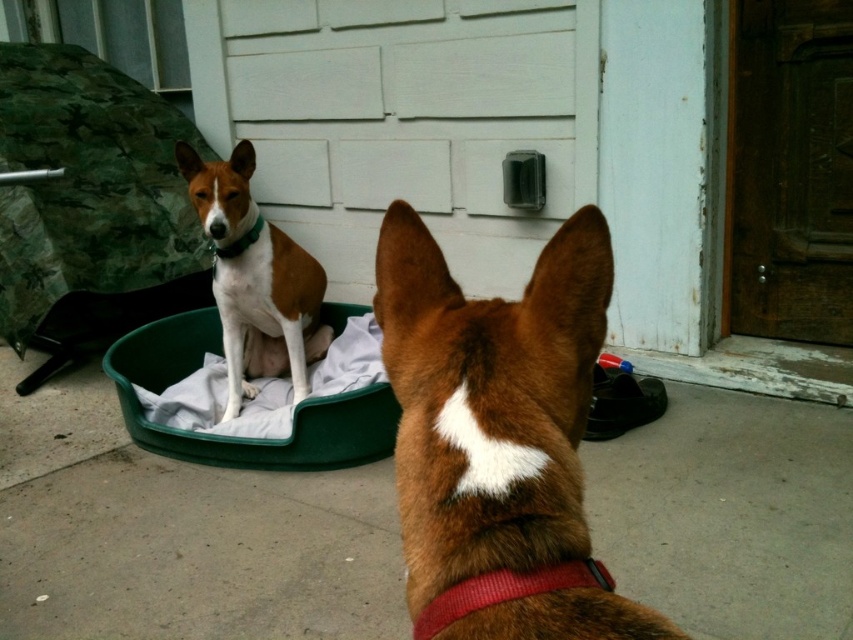
You are a dog owner who wants to ensure your new dog bed is large enough for both dogs. Based on the image, which dog is shorter, the brown furry dog at center or the green fabric dog bed at center?

The brown furry dog at center is shorter than the green fabric dog bed at center, so the bed should accommodate both dogs since the bed is taller than the dog.

You are standing in front of the garage door and want to take a photo of the point at coordinates point (459, 602). The camera you are using has a minimum focus distance of 20 inches. Will the point be in focus?

The point (459, 602) is 20.07 inches from the camera, which is just beyond the minimum focus distance of 20 inches. Therefore, the point may not be in focus unless the camera can adjust slightly beyond the specified distance.